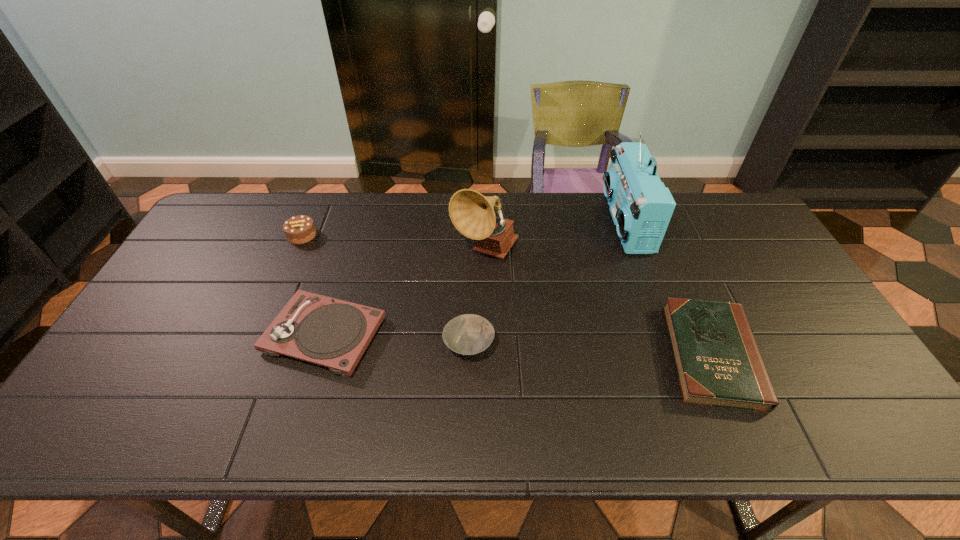
The height and width of the screenshot is (540, 960). I want to click on radio receiver, so click(x=641, y=206).

Identify the location of the farther phonograph_record. (472, 214).

Find the location of a particular element. the taller phonograph_record is located at coordinates (472, 214).

The height and width of the screenshot is (540, 960). Identify the location of chocolate cake. (300, 229).

Find the location of a particular element. the fourth tallest object is located at coordinates (334, 333).

You are a GUI agent. You are given a task and a screenshot of the screen. Output one action in this format:
    pyautogui.click(x=<x>, y=<y>)
    Task: Click on the nearer phonograph_record
    
    Given the screenshot: What is the action you would take?
    pyautogui.click(x=334, y=333)

The image size is (960, 540). Find the location of `bowl`. bowl is located at coordinates (469, 334).

In order to click on Bible in this screenshot , I will do `click(718, 363)`.

At what (x,y) coordinates should I click in order to perform the action: click on vacant space located 0.280m on the front-facing side of the radio receiver. Please return your answer as a coordinate pair (x, y). This screenshot has height=540, width=960. Looking at the image, I should click on (525, 222).

The width and height of the screenshot is (960, 540). I want to click on vacant area situated on the front-facing side of the radio receiver, so click(x=549, y=222).